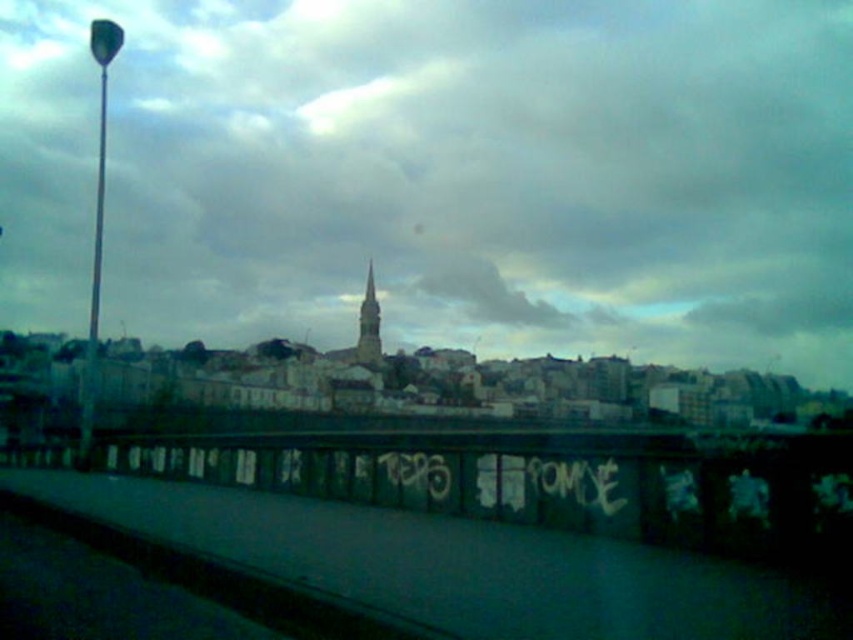
Based on the photo, you are an architect analyzing the cityscape. You need to determine which object occupies more horizontal space in the image between the cloudy sky at upper center and the smooth stone spire at center. Based on the provided information, which one is wider?

The cloudy sky at upper center is wider than the smooth stone spire at center because its width surpasses that of the spire.

You are standing in the cityscape scene looking at the two points marked in the image. Which point, point (x=548, y=468) or point (x=367, y=326), is closer to you?

Point (x=548, y=468) is closer to the viewer than point (x=367, y=326).